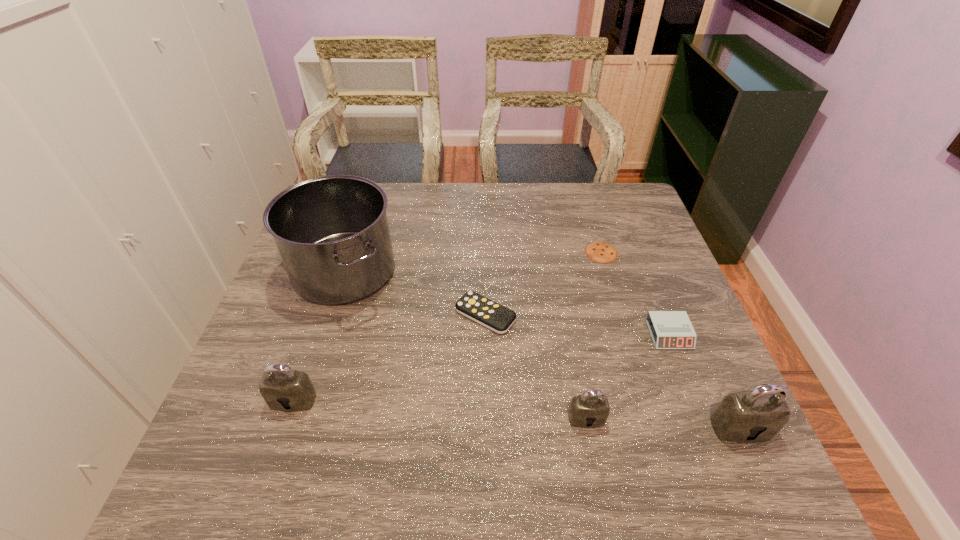
You are a GUI agent. You are given a task and a screenshot of the screen. Output one action in this format:
    pyautogui.click(x=<x>, y=<y>)
    Task: Click on the cookie at the right edge
    This screenshot has width=960, height=540.
    Given the screenshot: What is the action you would take?
    pyautogui.click(x=602, y=252)

Where is `alarm clock that is at the right edge`? This screenshot has width=960, height=540. alarm clock that is at the right edge is located at coordinates (669, 329).

Find the location of a particular element. object located in the near left corner section of the desktop is located at coordinates click(x=283, y=389).

This screenshot has height=540, width=960. Find the location of `object that is at the near right corner`. object that is at the near right corner is located at coordinates (757, 415).

At what (x,y) coordinates should I click in order to perform the action: click on vacant space at the far edge of the desktop. Please return your answer as a coordinate pair (x, y). Looking at the image, I should click on (388, 186).

Find the location of a particular element. This screenshot has width=960, height=540. vacant area at the near edge of the desktop is located at coordinates (508, 434).

I want to click on vacant space at the left edge, so click(277, 306).

In the image, there is a desktop. At what (x,y) coordinates should I click in order to perform the action: click on vacant space at the right edge. Please return your answer as a coordinate pair (x, y). The height and width of the screenshot is (540, 960). Looking at the image, I should click on (684, 383).

This screenshot has height=540, width=960. What are the coordinates of `free space at the near left corner of the desktop` in the screenshot? It's located at (228, 399).

The height and width of the screenshot is (540, 960). In the image, there is a desktop. Find the location of `vacant space at the near right corner`. vacant space at the near right corner is located at coordinates (713, 430).